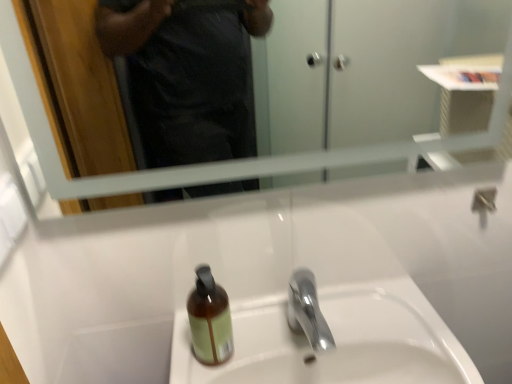
Find the location of a particular element. free space between brown glass bottle at center and polished chrome faucet at center is located at coordinates (254, 344).